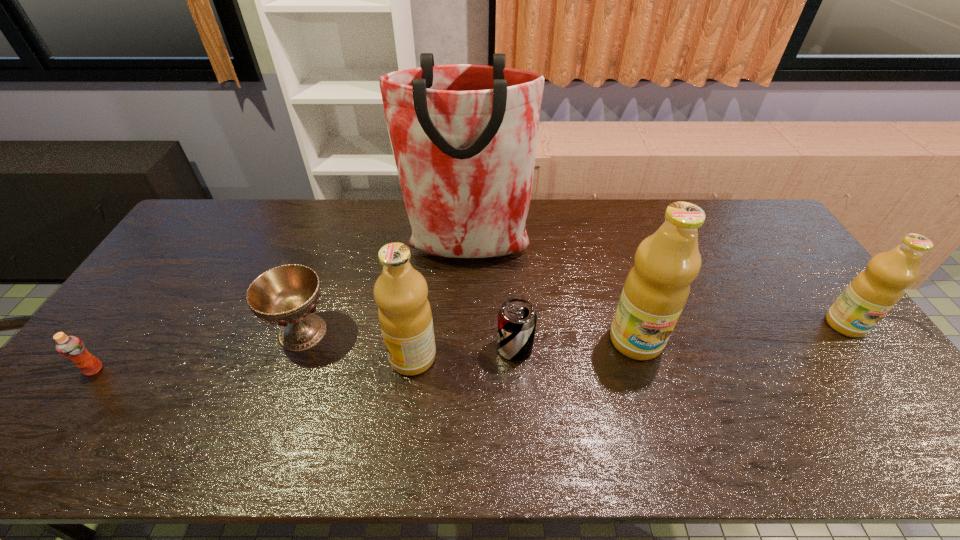
The width and height of the screenshot is (960, 540). What are the coordinates of `the second tallest olive oil` in the screenshot? It's located at coord(404,312).

This screenshot has width=960, height=540. Find the location of `the leftmost olive oil`. the leftmost olive oil is located at coordinates (404, 312).

You are a GUI agent. You are given a task and a screenshot of the screen. Output one action in this format:
    pyautogui.click(x=<x>, y=<y>)
    Task: Click on the sixth object from left to right
    This screenshot has width=960, height=540.
    Given the screenshot: What is the action you would take?
    pyautogui.click(x=657, y=287)

The height and width of the screenshot is (540, 960). Find the location of `the fourth shortest object`. the fourth shortest object is located at coordinates (876, 290).

Identify the location of the rightmost olive oil. The height and width of the screenshot is (540, 960). (876, 290).

Locate an element on the screen. chalice is located at coordinates (286, 295).

Identify the location of the farthest object. (464, 137).

Identify the location of grocery bag. (464, 137).

The image size is (960, 540). What are the coordinates of `orange juice` in the screenshot? It's located at (x=71, y=347).

Locate an element on the screen. soda can is located at coordinates (517, 319).